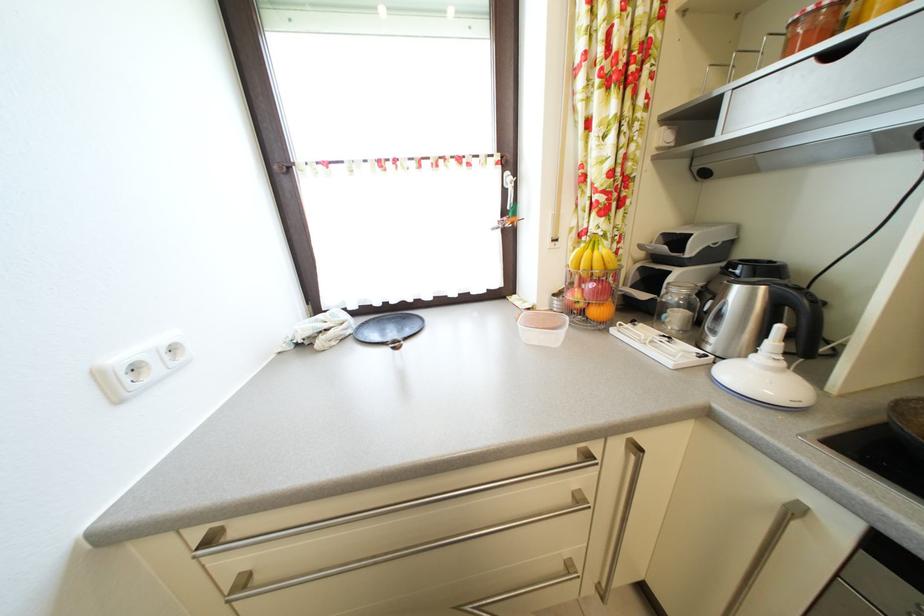
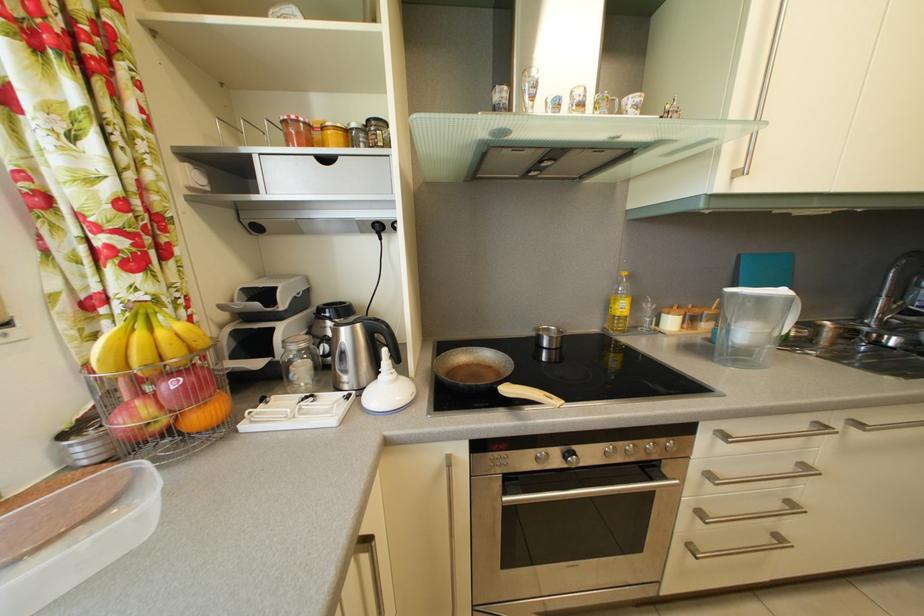
Question: The images are taken continuously from a first-person perspective. In which direction is your viewpoint rotating?

Choices:
 (A) Left
 (B) Right
 (C) Up
 (D) Down

Answer: (B)